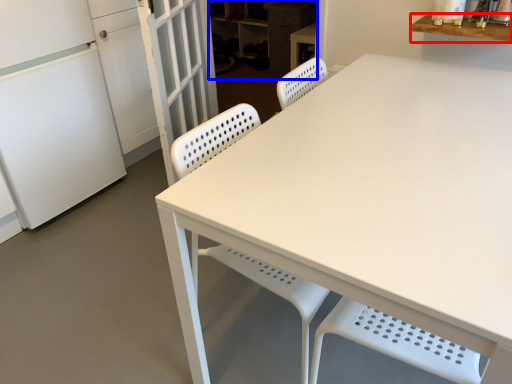
Question: Which of the following is the closest to the observer, counter top (highlighted by a red box) or cabinetry (highlighted by a blue box)?

Choices:
 (A) counter top
 (B) cabinetry

Answer: (A)